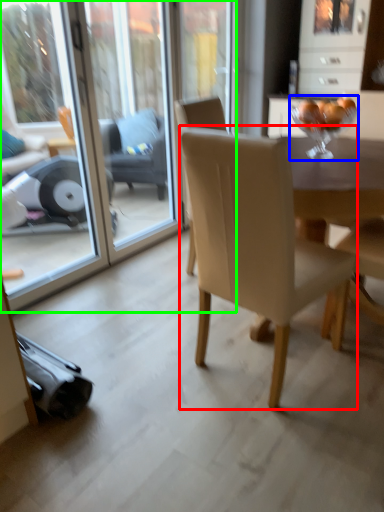
Question: Estimate the real-world distances between objects in this image. Which object is closer to chair (highlighted by a red box), wine glass (highlighted by a blue box) or screen door (highlighted by a green box)?

Choices:
 (A) wine glass
 (B) screen door

Answer: (A)